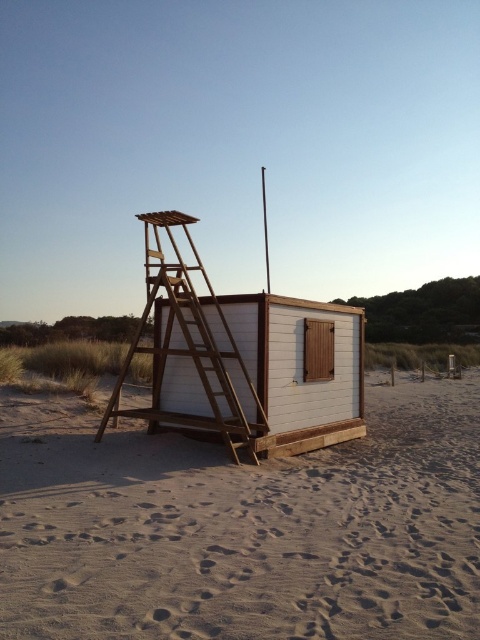
Does point (120, 433) come behind point (191, 337)?

Yes, point (120, 433) is behind point (191, 337).

Is sandy beige at lower center above wooden ladder at center?

Incorrect, sandy beige at lower center is not positioned above wooden ladder at center.

Who is more distant from viewer, (x=113, y=444) or (x=220, y=392)?

Point (x=220, y=392)

At what (x,y) coordinates should I click in order to perform the action: click on sandy beige at lower center. Please return your answer as a coordinate pair (x, y). Image resolution: width=480 pixels, height=640 pixels. Looking at the image, I should click on (250, 531).

Does sandy beige at lower center come in front of white wood beach hut at center?

Yes.

Is the position of sandy beige at lower center more distant than that of white wood beach hut at center?

That is False.

Is point (343, 616) closer to viewer compared to point (254, 301)?

Yes, point (343, 616) is in front of point (254, 301).

Identify the location of sandy beige at lower center. The image size is (480, 640). (250, 531).

Can you confirm if white wood beach hut at center is smaller than wooden ladder at center?

Correct, white wood beach hut at center occupies less space than wooden ladder at center.

Can you confirm if white wood beach hut at center is shorter than wooden ladder at center?

Indeed, white wood beach hut at center has a lesser height compared to wooden ladder at center.

Is point (358, 323) farther from viewer compared to point (207, 342)?

Yes, it is behind point (207, 342).

Locate an element on the screen. white wood beach hut at center is located at coordinates (300, 368).